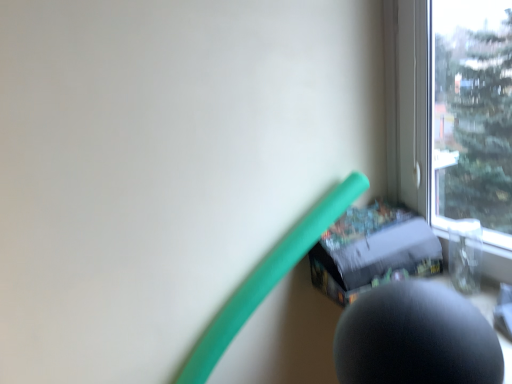
Locate an element on the screen. The width and height of the screenshot is (512, 384). black matte ball at lower right is located at coordinates (416, 338).

What do you see at coordinates (416, 338) in the screenshot?
I see `black matte ball at lower right` at bounding box center [416, 338].

Identify the location of black matte ball at lower right. The width and height of the screenshot is (512, 384). (416, 338).